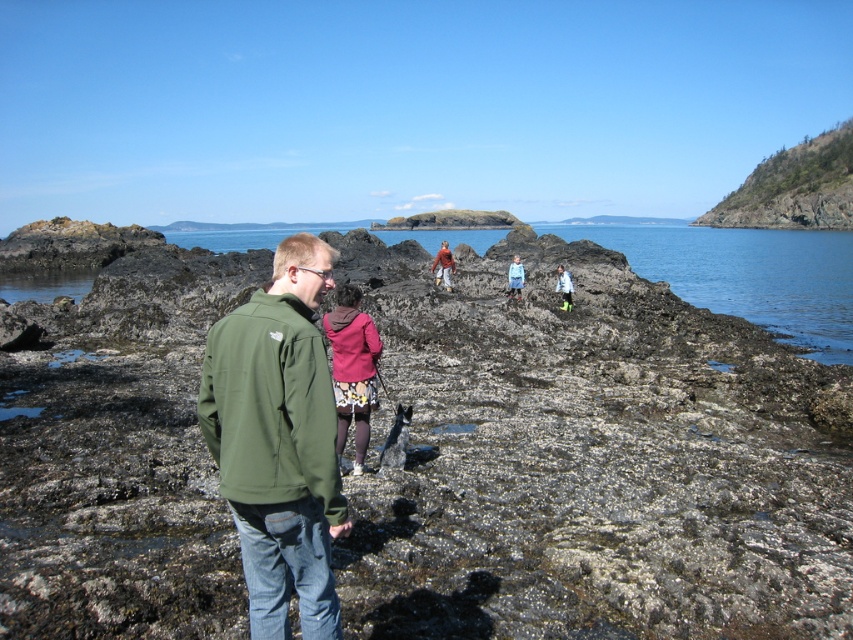
Question: Can you confirm if blue denim jacket at center is positioned below light blue rubber boots at center?

Choices:
 (A) no
 (B) yes

Answer: (A)

Question: Is matte pink jacket at center in front of matte red sweater at center?

Choices:
 (A) yes
 (B) no

Answer: (A)

Question: Which point is closer to the camera taking this photo?

Choices:
 (A) (318, 426)
 (B) (444, 280)

Answer: (A)

Question: Does matte pink jacket at center appear on the left side of matte red sweater at center?

Choices:
 (A) no
 (B) yes

Answer: (B)

Question: Which of these objects is positioned farthest from the matte pink jacket at center?

Choices:
 (A) green softshell jacket at center
 (B) matte red sweater at center
 (C) blue denim jacket at center

Answer: (B)

Question: Among these objects, which one is farthest from the camera?

Choices:
 (A) blue denim jacket at center
 (B) green softshell jacket at center
 (C) matte pink jacket at center
 (D) light blue rubber boots at center

Answer: (A)